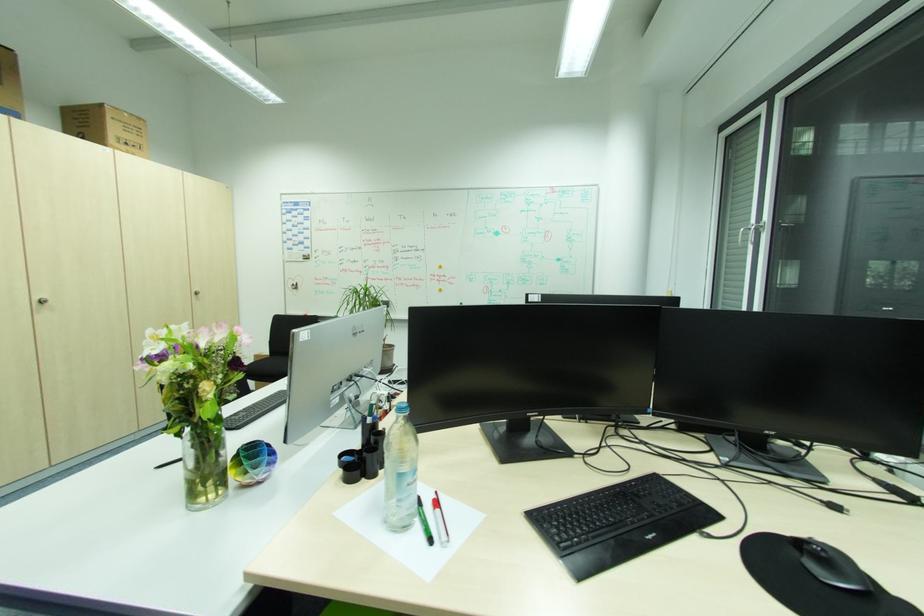
Find where to lift the glass water bottle. Please return your answer as a coordinate pair (x, y).

(399, 471)